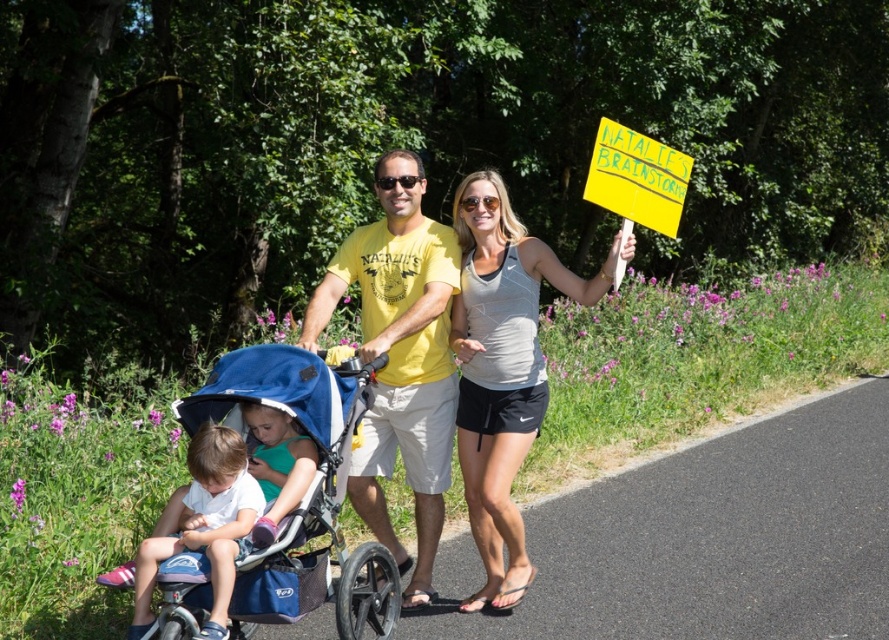
Question: Considering the real-world distances, which object is farthest from the blue fabric stroller at left?

Choices:
 (A) gray athletic tank top at upper center
 (B) matte green shirt at center
 (C) yellow cotton t-shirt at center

Answer: (A)

Question: Which point is farther from the camera taking this photo?

Choices:
 (A) (252, 531)
 (B) (172, 596)

Answer: (A)

Question: Observing the image, what is the correct spatial positioning of yellow cotton t-shirt at center in reference to light blue fabric stroller at lower left?

Choices:
 (A) left
 (B) right

Answer: (B)

Question: Can you confirm if yellow cotton t-shirt at center is smaller than gray athletic tank top at upper center?

Choices:
 (A) no
 (B) yes

Answer: (B)

Question: Which object is closer to the camera taking this photo?

Choices:
 (A) gray athletic tank top at upper center
 (B) yellow cotton t-shirt at center

Answer: (B)

Question: Where is blue fabric stroller at left located in relation to light blue fabric stroller at lower left in the image?

Choices:
 (A) below
 (B) above

Answer: (A)